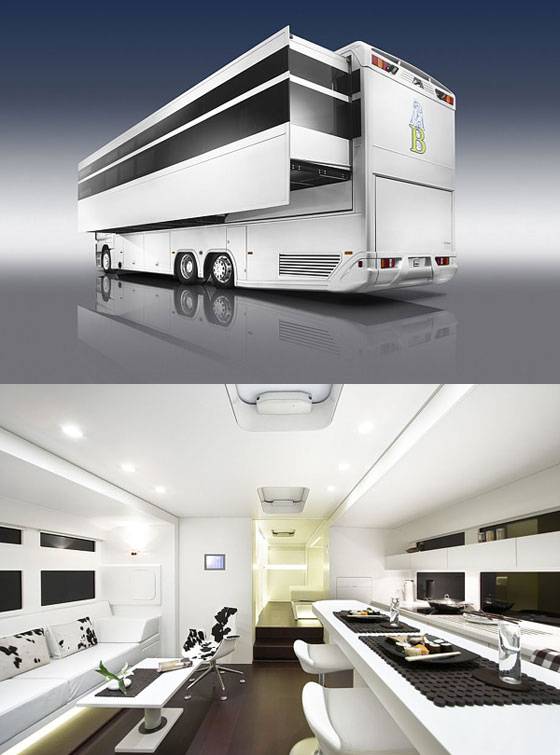
Where is `places to sit and eat`? The image size is (560, 755). places to sit and eat is located at coordinates (337, 722), (325, 657).